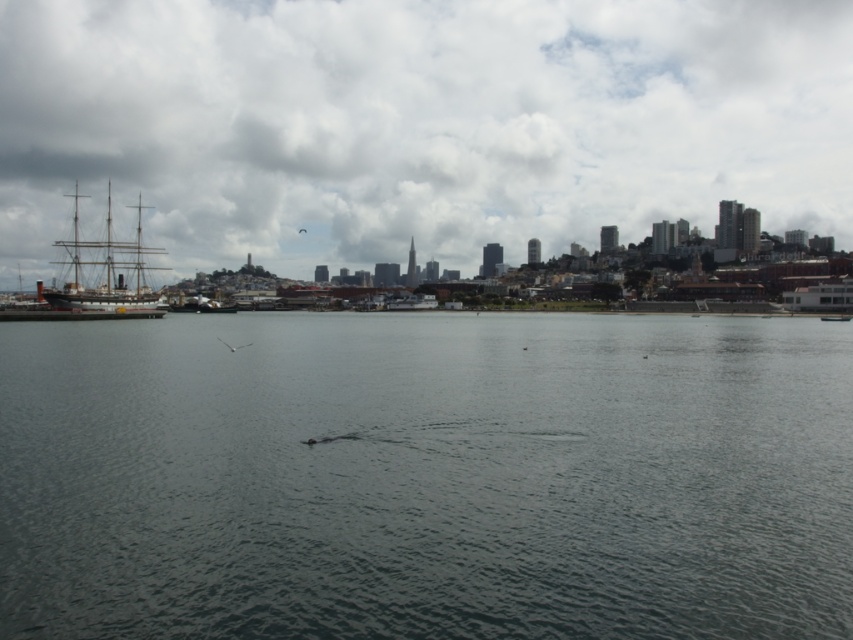
Question: Which point is farther to the camera?

Choices:
 (A) dark gray water at center
 (B) shiny silver boat at center-left

Answer: (B)

Question: Among these points, which one is farthest from the camera?

Choices:
 (A) (207, 307)
 (B) (35, 180)

Answer: (B)

Question: Does cloudy sky at upper center have a greater width compared to wooden ship at left?

Choices:
 (A) yes
 (B) no

Answer: (A)

Question: Where is wooden ship at left located in relation to shiny silver boat at center-left in the image?

Choices:
 (A) above
 (B) below

Answer: (A)

Question: Can you confirm if dark gray water at center is wider than wooden ship at left?

Choices:
 (A) yes
 (B) no

Answer: (B)

Question: Estimate the real-world distances between objects in this image. Which object is closer to the cloudy sky at upper center?

Choices:
 (A) dark gray water at center
 (B) shiny silver boat at center-left
 (C) wooden ship at left

Answer: (C)